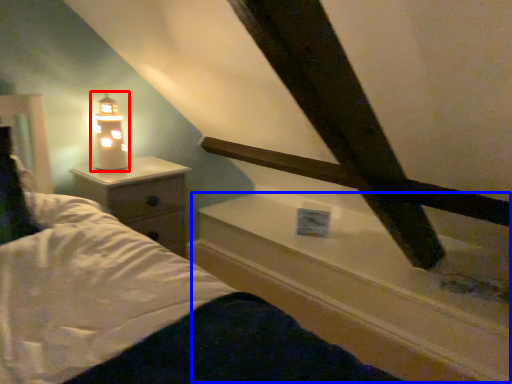
Question: Which object appears closest to the camera in this image, lamp (highlighted by a red box) or window sill (highlighted by a blue box)?

Choices:
 (A) lamp
 (B) window sill

Answer: (B)